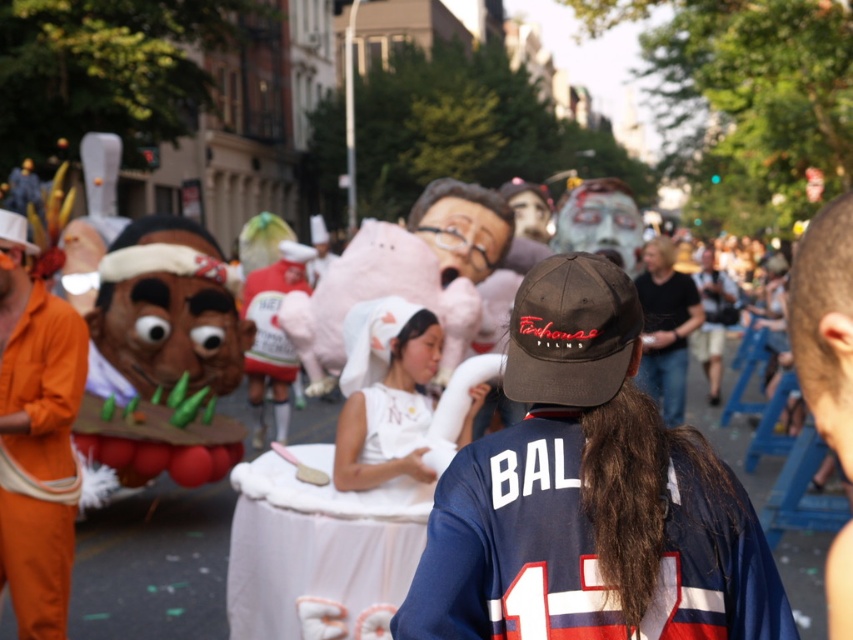
Does matte brown statue at center have a larger size compared to orange fabric costume at left?

Yes.

Is matte brown statue at center taller than orange fabric costume at left?

No, matte brown statue at center is not taller than orange fabric costume at left.

Does point (712, 417) come behind point (44, 369)?

Yes, it is behind point (44, 369).

Locate an element on the screen. The width and height of the screenshot is (853, 640). matte brown statue at center is located at coordinates (154, 564).

Can you confirm if brown fabric baseball cap at center is shorter than pink cotton candy at center?

Indeed, brown fabric baseball cap at center has a lesser height compared to pink cotton candy at center.

Can you confirm if brown fabric baseball cap at center is positioned above pink cotton candy at center?

Incorrect, brown fabric baseball cap at center is not positioned above pink cotton candy at center.

Is point (606, 317) positioned before point (445, 296)?

Yes.

Locate an element on the screen. brown fabric baseball cap at center is located at coordinates (572, 332).

Who is more forward, (556, 285) or (453, 234)?

Point (556, 285)

Which is behind, point (556, 372) or point (473, 246)?

The point (473, 246) is more distant.

Which is behind, point (635, 330) or point (434, 241)?

Point (434, 241)

The image size is (853, 640). Find the location of `brown fabric baseball cap at center`. brown fabric baseball cap at center is located at coordinates (572, 332).